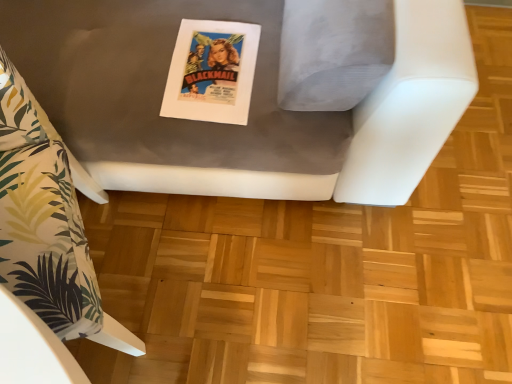
Question: Considering the relative positions of white fabric pillow at left, the second furniture from the right, and matte paper poster at center in the image provided, is white fabric pillow at left, the second furniture from the right, to the right of matte paper poster at center from the viewer's perspective?

Choices:
 (A) no
 (B) yes

Answer: (A)

Question: Is matte paper poster at center surrounded by white fabric pillow at left, which is counted as the first furniture, starting from the left?

Choices:
 (A) no
 (B) yes

Answer: (A)

Question: Does white fabric pillow at left, which is counted as the first furniture, starting from the left, have a lesser height compared to matte paper poster at center?

Choices:
 (A) yes
 (B) no

Answer: (B)

Question: Is white fabric pillow at left, the second furniture from the right, turned away from matte paper poster at center?

Choices:
 (A) yes
 (B) no

Answer: (B)

Question: Is white fabric pillow at left, which is counted as the first furniture, starting from the left, at the left side of matte paper poster at center?

Choices:
 (A) yes
 (B) no

Answer: (A)

Question: Considering their positions, is matte gray cushion at center, the 2th furniture in the left-to-right sequence, located in front of or behind matte paper poster at center?

Choices:
 (A) behind
 (B) front

Answer: (B)

Question: Is point (94, 112) closer or farther from the camera than point (168, 114)?

Choices:
 (A) closer
 (B) farther

Answer: (B)

Question: Based on their sizes in the image, would you say matte gray cushion at center, which is counted as the 1th furniture, starting from the right, is bigger or smaller than matte paper poster at center?

Choices:
 (A) small
 (B) big

Answer: (B)

Question: Is matte gray cushion at center, which is counted as the 1th furniture, starting from the right, inside or outside of matte paper poster at center?

Choices:
 (A) inside
 (B) outside

Answer: (B)

Question: From a real-world perspective, is matte paper poster at center physically located above or below white fabric pillow at left, which is counted as the first furniture, starting from the left?

Choices:
 (A) above
 (B) below

Answer: (A)

Question: Which is correct: matte paper poster at center is inside white fabric pillow at left, which is counted as the first furniture, starting from the left, or outside of it?

Choices:
 (A) inside
 (B) outside

Answer: (B)

Question: In terms of height, does matte paper poster at center look taller or shorter compared to white fabric pillow at left, which is counted as the first furniture, starting from the left?

Choices:
 (A) tall
 (B) short

Answer: (B)

Question: Considering their positions, is matte paper poster at center located in front of or behind white fabric pillow at left, the second furniture from the right?

Choices:
 (A) front
 (B) behind

Answer: (B)

Question: In terms of width, does matte paper poster at center look wider or thinner when compared to matte gray cushion at center, which is counted as the 1th furniture, starting from the right?

Choices:
 (A) wide
 (B) thin

Answer: (B)

Question: From the image's perspective, is matte paper poster at center above or below matte gray cushion at center, which is counted as the 1th furniture, starting from the right?

Choices:
 (A) below
 (B) above

Answer: (A)